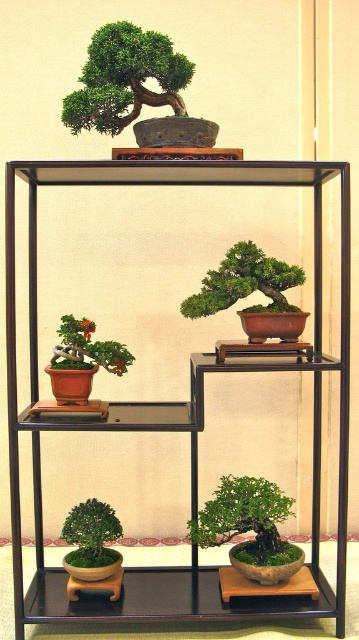
You are a gardener who needs to water the green matte bonsai tree at upper center. The watering can you are holding has a 12 inch long spout. Can you reach the bonsai tree without moving the transparent glass shelf at upper center?

The distance between the transparent glass shelf at upper center and the green matte bonsai tree at upper center is 14.22 inches. Since the watering can spout is only 12 inches long, you cannot reach the bonsai tree without moving the shelf.

You are an interior designer assessing the bonsai display. You need to determine if the transparent glass shelf at upper center can support the green matte bonsai tree at upper center without obstructing its view. Based on their height relationship, is this feasible?

The transparent glass shelf at upper center has a greater height compared to the green matte bonsai tree at upper center, meaning the shelf is taller than the tree. This would allow the tree to be placed on the shelf without obstruction, as the shelf provides sufficient vertical space.